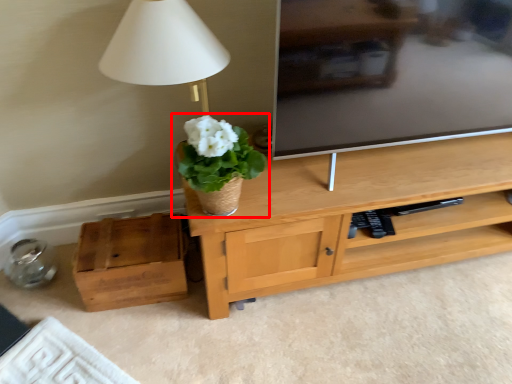
Question: From the image's perspective, considering the relative positions of houseplant (annotated by the red box) and box in the image provided, where is houseplant (annotated by the red box) located with respect to the staircase?

Choices:
 (A) above
 (B) below

Answer: (A)